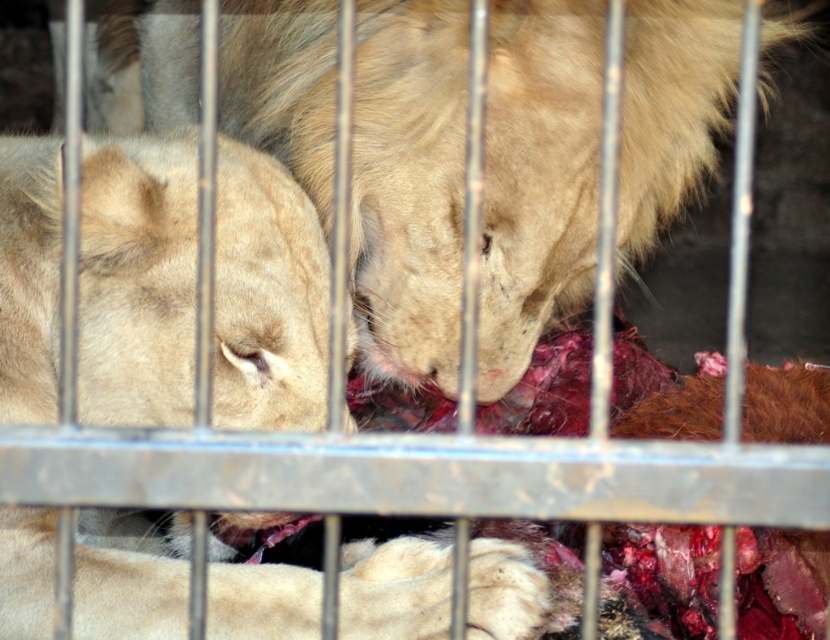
You are a photographer taking a picture of the lions through the cage bars. You notice two points on the cage bars at coordinates point [287,42] and point [37,340]. Which point is closer to your camera?

Point [287,42] is further to the camera than point [37,340], so the closer point to your camera is point [37,340].